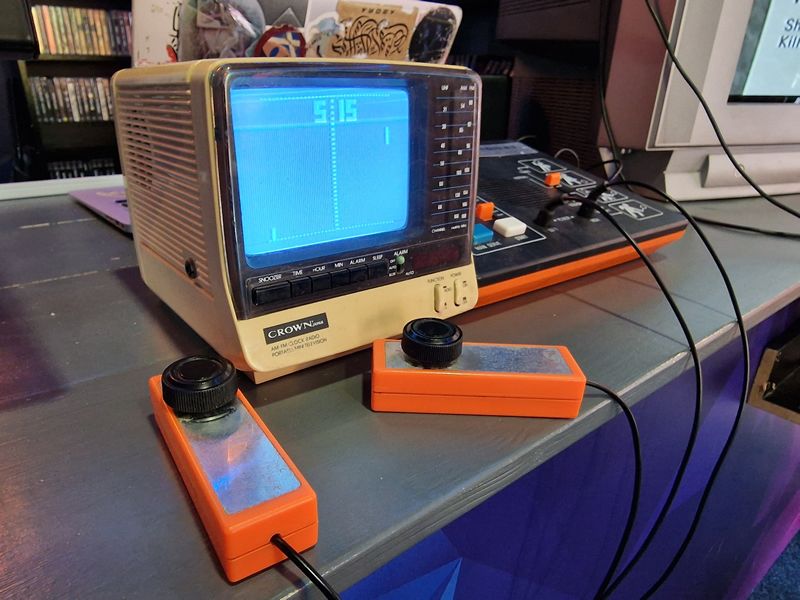
Locate an element on the screen. The width and height of the screenshot is (800, 600). switches is located at coordinates (512, 220), (488, 231), (488, 206).